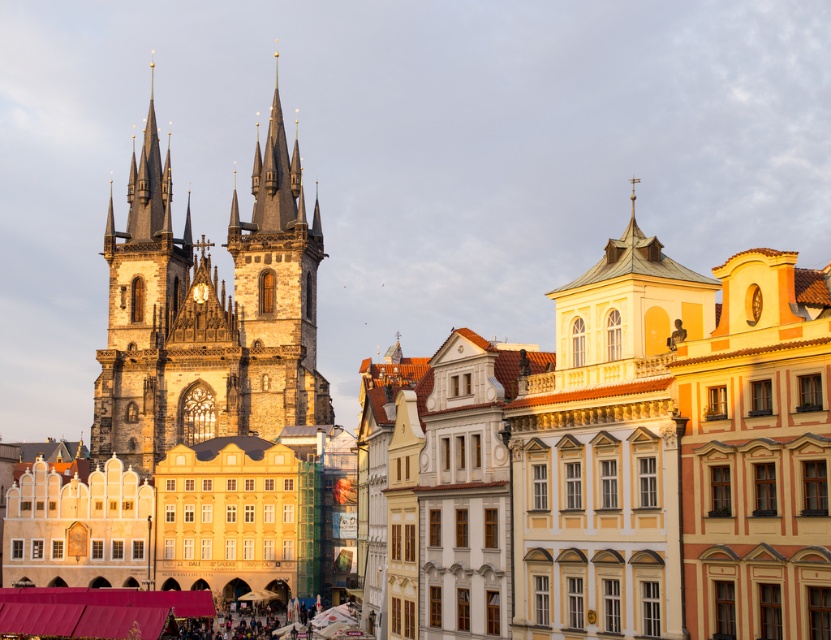
Question: Is dark stone tower at left smaller than dark stone tower at center?

Choices:
 (A) no
 (B) yes

Answer: (A)

Question: From the image, what is the correct spatial relationship of dark stone tower at left in relation to dark stone tower at center?

Choices:
 (A) left
 (B) right

Answer: (A)

Question: Among these objects, which one is nearest to the camera?

Choices:
 (A) dark stone tower at left
 (B) dark stone tower at center

Answer: (A)

Question: Which of the following is the farthest from the observer?

Choices:
 (A) (259, 321)
 (B) (150, 243)

Answer: (B)

Question: Among these points, which one is nearest to the camera?

Choices:
 (A) (188, 372)
 (B) (244, 288)

Answer: (B)

Question: Can you confirm if dark stone tower at left is smaller than dark stone tower at center?

Choices:
 (A) yes
 (B) no

Answer: (B)